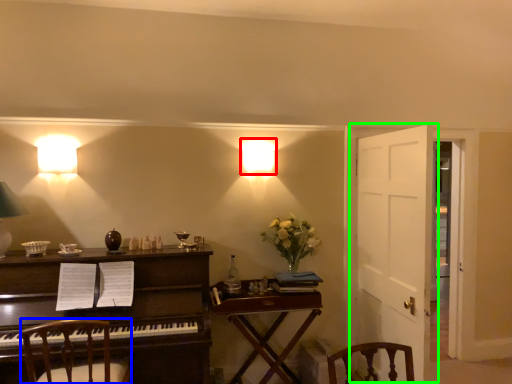
Question: Which is farther away from lamp (highlighted by a red box)? chair (highlighted by a blue box) or door (highlighted by a green box)?

Choices:
 (A) chair
 (B) door

Answer: (A)